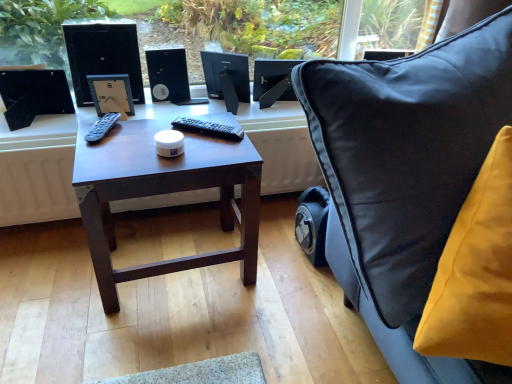
You are a GUI agent. You are given a task and a screenshot of the screen. Output one action in this format:
    pyautogui.click(x=<x>, y=<y>)
    Task: Click on the black glossy desktop computer at upper left
    The height and width of the screenshot is (384, 512).
    Given the screenshot: What is the action you would take?
    (102, 54)

At what (x,y) coordinates should I click in order to perform the action: click on black plastic speaker at center. Please return your answer as a coordinate pair (x, y). Looking at the image, I should click on (168, 74).

Where is `velvet yellow cushion at right`? velvet yellow cushion at right is located at coordinates (406, 176).

Which object is further away from the camera taking this photo, satin black monitor at upper center, the second computer monitor in the left-to-right sequence, or velvet yellow cushion at right?

satin black monitor at upper center, the second computer monitor in the left-to-right sequence, is further from the camera.

Can you confirm if satin black monitor at upper center, acting as the 1th computer monitor starting from the right, is positioned to the right of velvet yellow cushion at right?

Incorrect, satin black monitor at upper center, acting as the 1th computer monitor starting from the right, is not on the right side of velvet yellow cushion at right.

Is black glossy desktop computer at upper left beside black plastic speaker at center?

There is a gap between black glossy desktop computer at upper left and black plastic speaker at center.

In the scene shown: Considering the relative sizes of black glossy desktop computer at upper left and black plastic speaker at center in the image provided, is black glossy desktop computer at upper left wider than black plastic speaker at center?

Incorrect, the width of black glossy desktop computer at upper left does not surpass that of black plastic speaker at center.

Is black matte computer monitor at center, placed as the second computer monitor when sorted from right to left, not near dark wood table at center?

black matte computer monitor at center, placed as the second computer monitor when sorted from right to left, is actually quite close to dark wood table at center.

From the image's perspective, is black matte computer monitor at center, the first computer monitor viewed from the left, positioned above or below dark wood table at center?

From the image's perspective, black matte computer monitor at center, the first computer monitor viewed from the left, appears above dark wood table at center.

Which object is wider, black matte computer monitor at center, placed as the second computer monitor when sorted from right to left, or dark wood table at center?

With larger width is dark wood table at center.

Considering their positions, is black matte computer monitor at center, the first computer monitor viewed from the left, located in front of or behind dark wood table at center?

black matte computer monitor at center, the first computer monitor viewed from the left, is positioned farther from the viewer than dark wood table at center.

From a real-world perspective, relative to velvet yellow cushion at right, is black glossy desktop computer at upper left vertically above or below?

black glossy desktop computer at upper left is below velvet yellow cushion at right.

Based on the photo, considering the sizes of objects black glossy desktop computer at upper left and velvet yellow cushion at right in the image provided, who is smaller, black glossy desktop computer at upper left or velvet yellow cushion at right?

black glossy desktop computer at upper left.

From the image's perspective, would you say black glossy desktop computer at upper left is positioned over velvet yellow cushion at right?

Yes, from the image's perspective, black glossy desktop computer at upper left is on top of velvet yellow cushion at right.

How different are the orientations of black glossy desktop computer at upper left and velvet yellow cushion at right in degrees?

7.51 degrees separate the facing orientations of black glossy desktop computer at upper left and velvet yellow cushion at right.

Is dark wood table at center positioned behind black plastic speaker at center?

That is False.

Is dark wood table at center not close to black plastic speaker at center?

No.

Who is smaller, dark wood table at center or black plastic speaker at center?

black plastic speaker at center.

Based on the photo, is dark wood table at center inside or outside of black plastic speaker at center?

dark wood table at center is outside black plastic speaker at center.

Considering the positions of point (172, 90) and point (295, 99), is point (172, 90) closer or farther from the camera than point (295, 99)?

Clearly, point (172, 90) is closer to the camera than point (295, 99).

Does black plastic speaker at center appear on the left side of satin black monitor at upper center, acting as the 1th computer monitor starting from the right?

Yes, black plastic speaker at center is to the left of satin black monitor at upper center, acting as the 1th computer monitor starting from the right.

Who is taller, black plastic speaker at center or satin black monitor at upper center, the second computer monitor in the left-to-right sequence?

With more height is black plastic speaker at center.

Which object is wider, black plastic speaker at center or satin black monitor at upper center, acting as the 1th computer monitor starting from the right?

With larger width is black plastic speaker at center.

How many degrees apart are the facing directions of black glossy desktop computer at upper left and satin black monitor at upper center, acting as the 1th computer monitor starting from the right?

8.23 degrees separate the facing orientations of black glossy desktop computer at upper left and satin black monitor at upper center, acting as the 1th computer monitor starting from the right.

Which is more to the left, black glossy desktop computer at upper left or satin black monitor at upper center, acting as the 1th computer monitor starting from the right?

Positioned to the left is black glossy desktop computer at upper left.

Locate an element on the screen. The width and height of the screenshot is (512, 384). desktop computer that is in front of the satin black monitor at upper center, the second computer monitor in the left-to-right sequence is located at coordinates (102, 54).

Considering the points (106, 63) and (261, 107), which point is in front, point (106, 63) or point (261, 107)?

The point (106, 63) is closer.

From a real-world perspective, starting from the velvet yellow cushion at right, which computer monitor is the 2nd one below it? Please provide its 2D coordinates.

[(273, 81)]

I want to click on desktop computer to the left of black plastic speaker at center, so click(102, 54).

From the image, which object appears to be farther from black plastic speaker at center, black matte computer monitor at center, the first computer monitor viewed from the left, or black glossy desktop computer at upper left?

black glossy desktop computer at upper left is positioned further to the anchor black plastic speaker at center.

Looking at the image, which one is located closer to black plastic speaker at center, black glossy desktop computer at upper left or velvet yellow cushion at right?

Based on the image, black glossy desktop computer at upper left appears to be nearer to black plastic speaker at center.

Based on their spatial positions, is velvet yellow cushion at right or satin black monitor at upper center, the second computer monitor in the left-to-right sequence, closer to black plastic speaker at center?

Among the two, satin black monitor at upper center, the second computer monitor in the left-to-right sequence, is located nearer to black plastic speaker at center.

When comparing their distances from velvet yellow cushion at right, does black glossy desktop computer at upper left or black matte computer monitor at center, placed as the second computer monitor when sorted from right to left, seem closer?

Among the two, black matte computer monitor at center, placed as the second computer monitor when sorted from right to left, is located nearer to velvet yellow cushion at right.

Looking at the image, which one is located further to satin black monitor at upper center, acting as the 1th computer monitor starting from the right, black glossy desktop computer at upper left or black plastic speaker at center?

black glossy desktop computer at upper left is further to satin black monitor at upper center, acting as the 1th computer monitor starting from the right.

Looking at the image, which one is located closer to black plastic speaker at center, black matte computer monitor at center, the first computer monitor viewed from the left, or satin black monitor at upper center, acting as the 1th computer monitor starting from the right?

Based on the image, black matte computer monitor at center, the first computer monitor viewed from the left, appears to be nearer to black plastic speaker at center.

From the image, which object appears to be farther from dark wood table at center, black plastic speaker at center or velvet yellow cushion at right?

black plastic speaker at center is further to dark wood table at center.

Considering their positions, is black plastic speaker at center positioned further to velvet yellow cushion at right than satin black monitor at upper center, the second computer monitor in the left-to-right sequence?

black plastic speaker at center lies further to velvet yellow cushion at right than the other object.

Identify the location of table between black glossy desktop computer at upper left and satin black monitor at upper center, the second computer monitor in the left-to-right sequence. This screenshot has height=384, width=512. (163, 193).

You are a GUI agent. You are given a task and a screenshot of the screen. Output one action in this format:
    pyautogui.click(x=<x>, y=<y>)
    Task: Click on the desktop computer between dark wood table at center and black matte computer monitor at center, the first computer monitor viewed from the left, from front to back
    The width and height of the screenshot is (512, 384).
    Given the screenshot: What is the action you would take?
    pyautogui.click(x=102, y=54)

You are a GUI agent. You are given a task and a screenshot of the screen. Output one action in this format:
    pyautogui.click(x=<x>, y=<y>)
    Task: Click on the computer monitor situated between black plastic speaker at center and satin black monitor at upper center, acting as the 1th computer monitor starting from the right, from left to right
    This screenshot has height=384, width=512.
    Given the screenshot: What is the action you would take?
    pyautogui.click(x=227, y=73)

The image size is (512, 384). I want to click on table between velvet yellow cushion at right and black matte computer monitor at center, the first computer monitor viewed from the left, in the front-back direction, so click(163, 193).